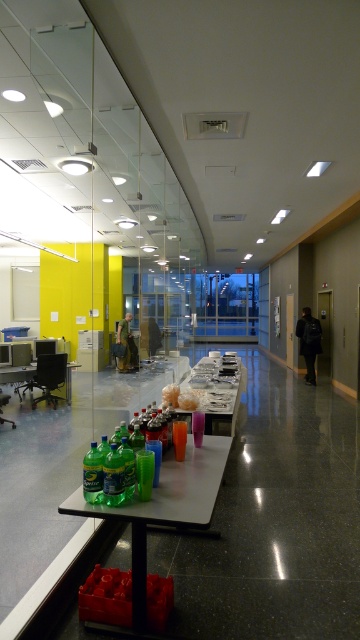
In the scene shown: You are standing in the break room and want to place a large coffee pot on the table closest to you. Which table should you choose between the translucent plastic table at lower center and the green plastic table at lower left?

The translucent plastic table at lower center is closer to the viewer, so you should choose the translucent plastic table at lower center to place the large coffee pot.

You are a maintenance worker needing to place a tall plant that requires a stable surface. Which object between the white glossy table at center and the green plastic table at lower left is more suitable for placing the plant?

The white glossy table at center is taller than the green plastic table at lower left, making it more suitable for placing the tall plant as it provides a higher and potentially more stable surface.

You are standing in the break room and want to take a photo of both the point at coordinates (212, 364) and the point at coordinates (23, 380). Which point should you focus on first to ensure both are in focus?

You should focus on the point at coordinates (212, 364) first because it is closer to the camera than the point at coordinates (23, 380). By focusing on the closer point, the farther point will also be within the depth of field and in focus.